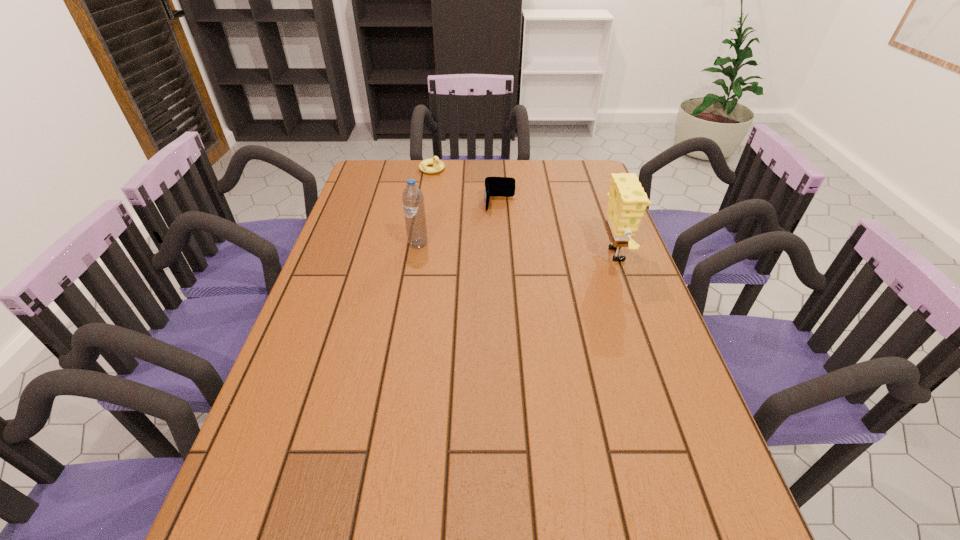
Image resolution: width=960 pixels, height=540 pixels. I want to click on free space located on the face of the farthest object, so click(x=467, y=199).

Locate an element on the screen. The width and height of the screenshot is (960, 540). vacant space situated on the face of the farthest object is located at coordinates (461, 194).

Locate an element on the screen. The height and width of the screenshot is (540, 960). object present at the far edge is located at coordinates [x=438, y=165].

The image size is (960, 540). I want to click on object present at the right edge, so [x=627, y=201].

This screenshot has height=540, width=960. I want to click on vacant area at the far edge of the desktop, so click(x=454, y=191).

Identify the location of free space at the near edge of the desktop. (630, 500).

Find the location of a particular element. The height and width of the screenshot is (540, 960). free space at the left edge is located at coordinates click(316, 302).

Identify the location of free space at the right edge. (630, 345).

In the image, there is a desktop. Identify the location of blank space at the far left corner. The width and height of the screenshot is (960, 540). (369, 188).

I want to click on free space at the near left corner, so click(319, 482).